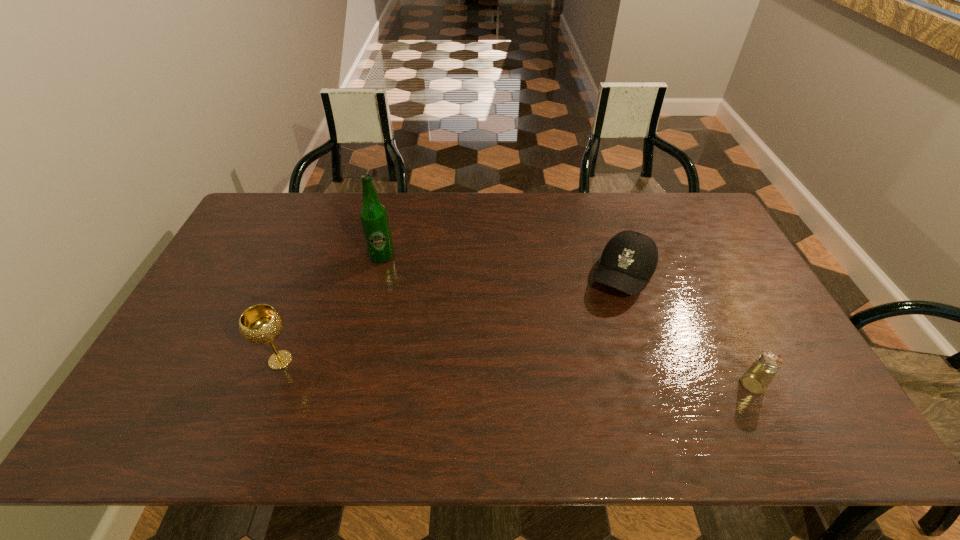
Locate an element on the screen. the leftmost object is located at coordinates (260, 324).

This screenshot has height=540, width=960. Find the location of `chalice`. chalice is located at coordinates (260, 324).

Find the location of a particular element. the rightmost object is located at coordinates click(756, 379).

At what (x,y) coordinates should I click in order to perform the action: click on beer bottle. Please return your answer as a coordinate pair (x, y). Looking at the image, I should click on (374, 219).

You are a GUI agent. You are given a task and a screenshot of the screen. Output one action in this format:
    pyautogui.click(x=<x>, y=<y>)
    Task: Click on the tallest object
    
    Given the screenshot: What is the action you would take?
    pyautogui.click(x=374, y=219)

Image resolution: width=960 pixels, height=540 pixels. I want to click on baseball cap, so click(x=629, y=259).

The height and width of the screenshot is (540, 960). I want to click on vacant region located on the left of the leftmost object, so click(x=177, y=360).

The image size is (960, 540). Identify the location of free spot located 0.160m on the left of the saltshaker. (675, 384).

You are a GUI agent. You are given a task and a screenshot of the screen. Output one action in this format:
    pyautogui.click(x=<x>, y=<y>)
    Task: Click on the vacant area situated on the label of the third object from right to left
    
    Given the screenshot: What is the action you would take?
    pyautogui.click(x=457, y=308)

Where is `free region located on the label of the third object from right to left`? The width and height of the screenshot is (960, 540). free region located on the label of the third object from right to left is located at coordinates tap(412, 276).